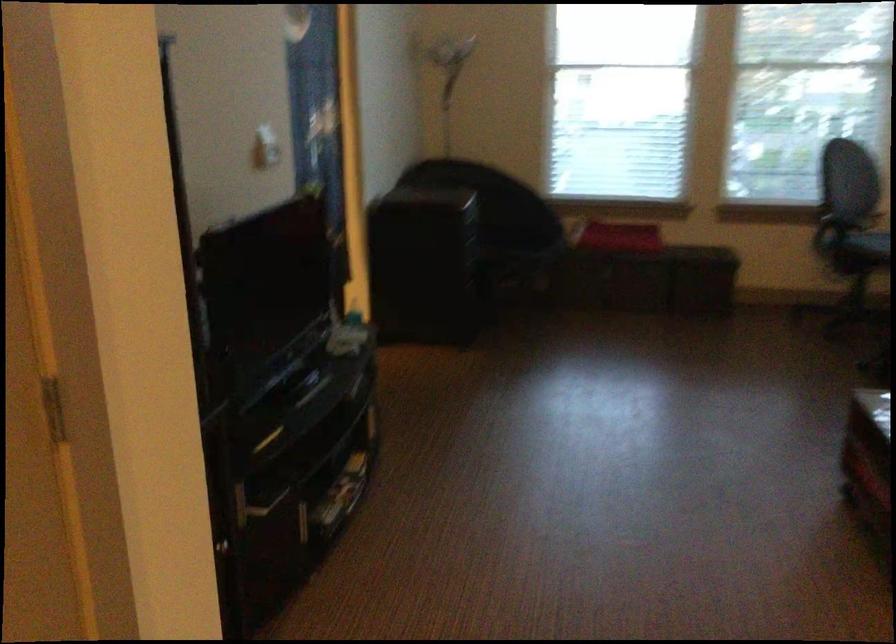
The width and height of the screenshot is (896, 644). What do you see at coordinates (864, 251) in the screenshot? I see `the chair sitting surface` at bounding box center [864, 251].